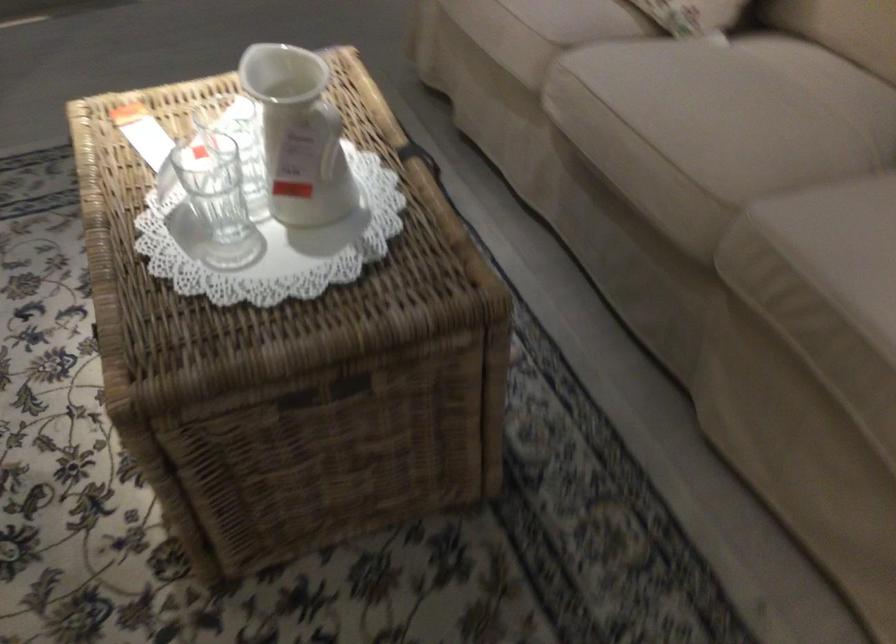
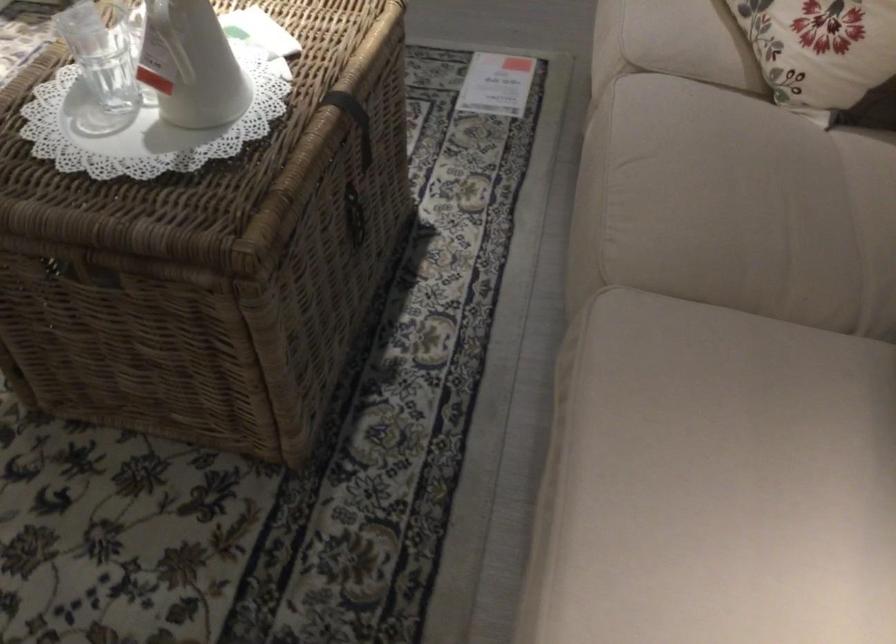
Question: The first image is from the beginning of the video and the second image is from the end. How did the camera likely rotate when shooting the video?

Choices:
 (A) Left
 (B) Right
 (C) Up
 (D) Down

Answer: (A)